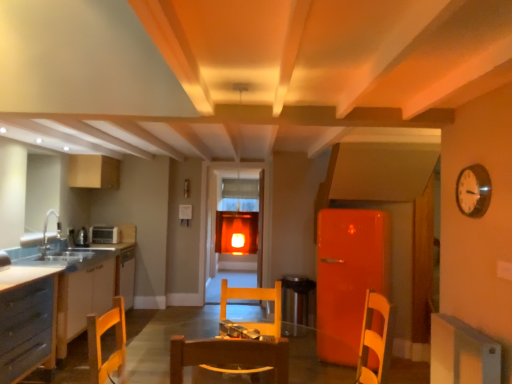
The height and width of the screenshot is (384, 512). What do you see at coordinates (104, 235) in the screenshot?
I see `white plastic toaster at left` at bounding box center [104, 235].

I want to click on white glossy countertop at left, so click(83, 284).

At what (x,y) coordinates should I click in order to perform the action: click on transparent glass door at center. Please return your answer as a coordinate pair (x, y). Image resolution: width=512 pixels, height=384 pixels. Looking at the image, I should click on (234, 212).

In order to click on matte wood cabinet at upper left, which ranks as the 1th cabinetry in top-to-bottom order in this screenshot , I will do 93,172.

What do you see at coordinates (462, 353) in the screenshot? The width and height of the screenshot is (512, 384). I see `white matte cabinet at lower right, marked as the first cabinetry in a right-to-left arrangement` at bounding box center [462, 353].

You are a GUI agent. You are given a task and a screenshot of the screen. Output one action in this format:
    pyautogui.click(x=<x>, y=<y>)
    Task: Click on the wooden chair at center
    The image size is (512, 384).
    Given the screenshot: What is the action you would take?
    pyautogui.click(x=255, y=299)

Would you say wooden round table at center is a long distance from white plastic toaster at left?

wooden round table at center is far away from white plastic toaster at left.

From a real-world perspective, is wooden round table at center on top of white plastic toaster at left?

Actually, wooden round table at center is physically below white plastic toaster at left in the real world.

Can white plastic toaster at left be found inside wooden round table at center?

Actually, white plastic toaster at left is outside wooden round table at center.

In terms of height, does wooden round table at center look taller or shorter compared to white plastic toaster at left?

In the image, wooden round table at center appears to be taller than white plastic toaster at left.

From a real-world perspective, is matte gray cabinet at left, acting as the second cabinetry starting from the front, located higher than wooden round table at center?

Yes, from a real-world perspective, matte gray cabinet at left, acting as the second cabinetry starting from the front, is above wooden round table at center.

Looking at this image, from the image's perspective, is matte gray cabinet at left, acting as the second cabinetry starting from the left, located above or below wooden round table at center?

Clearly, from the image's perspective, matte gray cabinet at left, acting as the second cabinetry starting from the left, is above wooden round table at center.

Based on the photo, can you tell me how much matte gray cabinet at left, acting as the second cabinetry starting from the front, and wooden round table at center differ in facing direction?

The facing directions of matte gray cabinet at left, acting as the second cabinetry starting from the front, and wooden round table at center are 89.1 degrees apart.

This screenshot has height=384, width=512. Find the location of `the 1st cabinetry in front of the wooden round table at center, counting from the anchor's position`. the 1st cabinetry in front of the wooden round table at center, counting from the anchor's position is located at coordinates (27, 320).

Is matte wood cabinet at upper left, the 3th cabinetry when ordered from bottom to top, bigger than white matte cabinet at lower right, arranged as the first cabinetry when viewed from the front?

Yes.

Starting from the matte wood cabinet at upper left, which ranks as the 1th cabinetry in top-to-bottom order, which cabinetry is the 2nd one to the right? Please provide its 2D coordinates.

[(462, 353)]

Choose the correct answer: Is matte wood cabinet at upper left, arranged as the first cabinetry when viewed from the left, inside white matte cabinet at lower right, which ranks as the second cabinetry in top-to-bottom order, or outside it?

matte wood cabinet at upper left, arranged as the first cabinetry when viewed from the left, lies outside white matte cabinet at lower right, which ranks as the second cabinetry in top-to-bottom order.

Is matte wood cabinet at upper left, arranged as the first cabinetry when viewed from the left, in front of white matte cabinet at lower right, the 2th cabinetry ordered from the bottom?

No, the depth of matte wood cabinet at upper left, arranged as the first cabinetry when viewed from the left, is greater than that of white matte cabinet at lower right, the 2th cabinetry ordered from the bottom.

Measure the distance between matte wood cabinet at upper left, the 3th cabinetry when ordered from right to left, and wooden round table at center.

matte wood cabinet at upper left, the 3th cabinetry when ordered from right to left, and wooden round table at center are 10.94 feet apart.

From the image's perspective, which is above, matte wood cabinet at upper left, arranged as the first cabinetry when viewed from the left, or wooden round table at center?

matte wood cabinet at upper left, arranged as the first cabinetry when viewed from the left, is shown above in the image.

From a real-world perspective, is matte wood cabinet at upper left, the third cabinetry positioned from the front, above or below wooden round table at center?

Clearly, from a real-world perspective, matte wood cabinet at upper left, the third cabinetry positioned from the front, is above wooden round table at center.

How far apart are transparent glass door at center and matte gray cabinet at left, which ranks as the 1th cabinetry in bottom-to-top order?

transparent glass door at center is 5.21 feet away from matte gray cabinet at left, which ranks as the 1th cabinetry in bottom-to-top order.

Is transparent glass door at center at the right side of matte gray cabinet at left, arranged as the 3th cabinetry when viewed from the top?

Yes.

Does transparent glass door at center have a larger size compared to matte gray cabinet at left, arranged as the 3th cabinetry when viewed from the top?

No.

From a real-world perspective, is transparent glass door at center physically located above or below matte gray cabinet at left, which ranks as the 1th cabinetry in bottom-to-top order?

In terms of real-world spatial position, transparent glass door at center is above matte gray cabinet at left, which ranks as the 1th cabinetry in bottom-to-top order.

Is transparent glass door at center a part of wooden chair at center?

No, transparent glass door at center is located outside of wooden chair at center.

Is wooden chair at center positioned before transparent glass door at center?

That is True.

Locate an element on the screen. The height and width of the screenshot is (384, 512). chair in front of the transparent glass door at center is located at coordinates (x=255, y=299).

Can you tell me how much wooden chair at center and transparent glass door at center differ in facing direction?

0.528 degrees.

Between wooden chair at center and white glossy countertop at left, which one has smaller size?

With smaller size is wooden chair at center.

Is wooden chair at center aimed at white glossy countertop at left?

No.

Between wooden chair at center and white glossy countertop at left, which one has less height?

wooden chair at center.

From the image's perspective, is wooden chair at center under white glossy countertop at left?

No.

At what (x,y) coordinates should I click in order to perform the action: click on round table below the white plastic toaster at left (from the image's perspective). Please return your answer as a coordinate pair (x, y). The height and width of the screenshot is (384, 512). Looking at the image, I should click on (298, 302).

Where is `the 1st cabinetry directly above the wooden round table at center (from a real-world perspective)`? The image size is (512, 384). the 1st cabinetry directly above the wooden round table at center (from a real-world perspective) is located at coordinates (27, 320).

Looking at this image, estimate the real-world distances between objects in this image. Which object is further from white matte cabinet at lower right, placed as the 3th cabinetry when sorted from left to right, transparent glass door at center or matte wood cabinet at upper left, which ranks as the 1th cabinetry in top-to-bottom order?

matte wood cabinet at upper left, which ranks as the 1th cabinetry in top-to-bottom order.

Considering their positions, is wooden round table at center positioned closer to white matte cabinet at lower right, marked as the first cabinetry in a right-to-left arrangement, than white plastic toaster at left?

Among the two, wooden round table at center is located nearer to white matte cabinet at lower right, marked as the first cabinetry in a right-to-left arrangement.

Based on their spatial positions, is matte gray cabinet at left, arranged as the 3th cabinetry when viewed from the top, or matte wood cabinet at upper left, the 3th cabinetry when ordered from right to left, closer to transparent glass door at center?

Based on the image, matte gray cabinet at left, arranged as the 3th cabinetry when viewed from the top, appears to be nearer to transparent glass door at center.

Based on their spatial positions, is matte wood cabinet at upper left, which ranks as the 1th cabinetry in top-to-bottom order, or white glossy countertop at left closer to matte gray cabinet at left, acting as the second cabinetry starting from the left?

white glossy countertop at left is positioned closer to the anchor matte gray cabinet at left, acting as the second cabinetry starting from the left.

Which object lies further to the anchor point wooden chair at center, white glossy countertop at left or wooden round table at center?

Among the two, wooden round table at center is located further to wooden chair at center.

Considering their positions, is white plastic toaster at left positioned further to matte wood cabinet at upper left, the 3th cabinetry when ordered from right to left, than transparent glass door at center?

The object further to matte wood cabinet at upper left, the 3th cabinetry when ordered from right to left, is transparent glass door at center.

From the picture: Considering their positions, is white plastic toaster at left positioned closer to wooden round table at center than wooden chair at center?

wooden chair at center is positioned closer to the anchor wooden round table at center.

Considering their positions, is white glossy countertop at left positioned closer to wooden round table at center than wooden chair at center?

Among the two, wooden chair at center is located nearer to wooden round table at center.

Where is `chair located between white glossy clock at upper right and wooden round table at center in the depth direction`? Image resolution: width=512 pixels, height=384 pixels. chair located between white glossy clock at upper right and wooden round table at center in the depth direction is located at coordinates (255, 299).

The height and width of the screenshot is (384, 512). Identify the location of cabinetry between matte wood cabinet at upper left, which appears as the 1th cabinetry when viewed from the back, and wooden round table at center from left to right. (27, 320).

The image size is (512, 384). I want to click on countertop positioned between matte gray cabinet at left, arranged as the 3th cabinetry when viewed from the top, and matte wood cabinet at upper left, the 3th cabinetry when ordered from right to left, from near to far, so click(83, 284).

At what (x,y) coordinates should I click in order to perform the action: click on cabinetry between white glossy countertop at left and wooden round table at center in the horizontal direction. Please return your answer as a coordinate pair (x, y). Looking at the image, I should click on (27, 320).